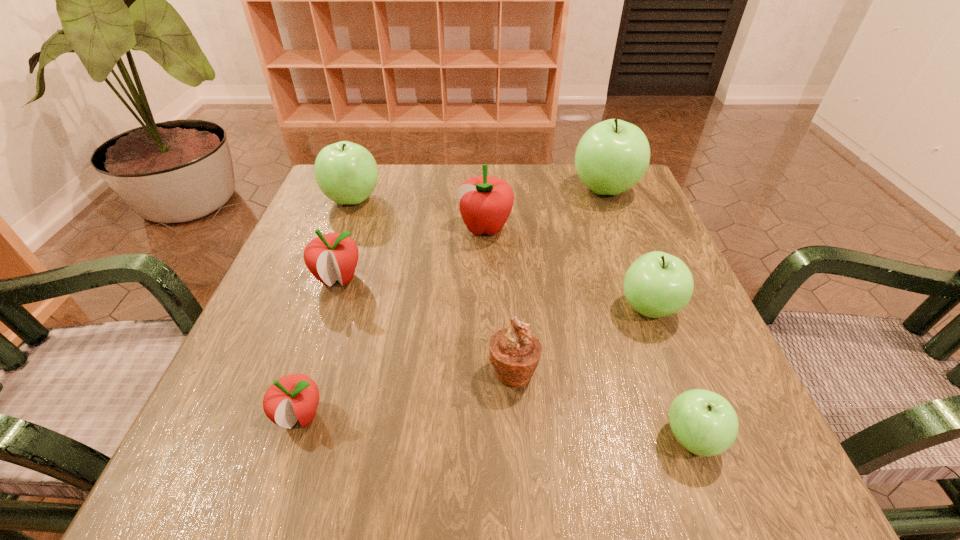
Where is `unoccupied area between the third biggest green apple and the biggest green apple`? The height and width of the screenshot is (540, 960). unoccupied area between the third biggest green apple and the biggest green apple is located at coordinates (627, 249).

At what (x,y) coordinates should I click in order to perform the action: click on free spot between the nearest red apple and the third smallest green apple. Please return your answer as a coordinate pair (x, y). This screenshot has width=960, height=540. Looking at the image, I should click on (326, 308).

I want to click on unoccupied area between the second biggest green apple and the farthest red apple, so click(x=420, y=214).

The width and height of the screenshot is (960, 540). I want to click on vacant area that lies between the fourth apple from right to left and the second smallest green apple, so click(567, 268).

This screenshot has width=960, height=540. What are the coordinates of `free spot between the leftmost green apple and the third biggest green apple` in the screenshot? It's located at (501, 254).

Where is `free space between the second farthest red apple and the smallest red apple`? This screenshot has width=960, height=540. free space between the second farthest red apple and the smallest red apple is located at coordinates (320, 347).

What are the coordinates of `vacant space in between the nearest green apple and the leftmost green apple` in the screenshot? It's located at (522, 319).

Find the location of `free space between the second biggest green apple and the third farthest green apple`. free space between the second biggest green apple and the third farthest green apple is located at coordinates (501, 254).

Identify the location of object that stands as the third closest to the second nearest green apple. (485, 202).

This screenshot has height=540, width=960. Identify the location of object that is the third nearest to the second farthest red apple. (295, 397).